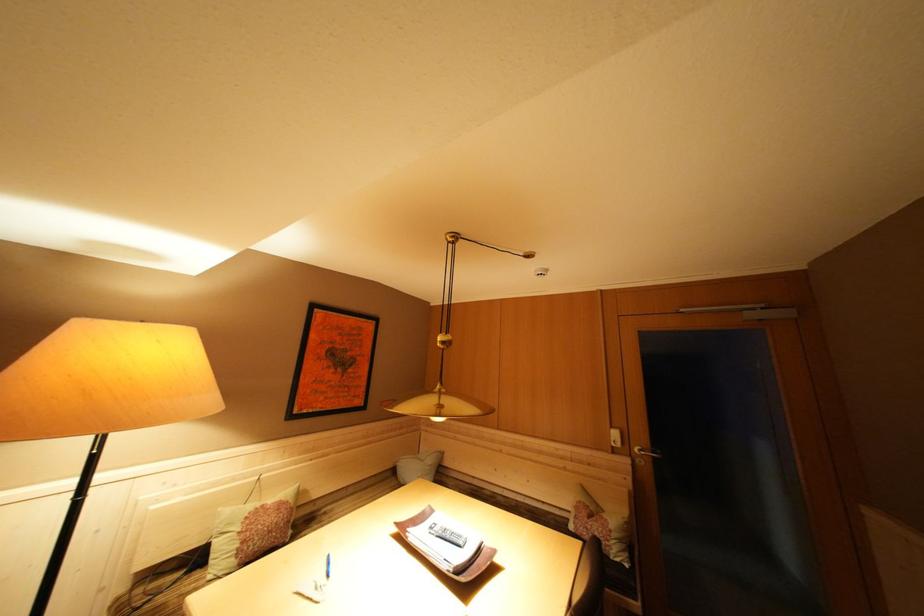
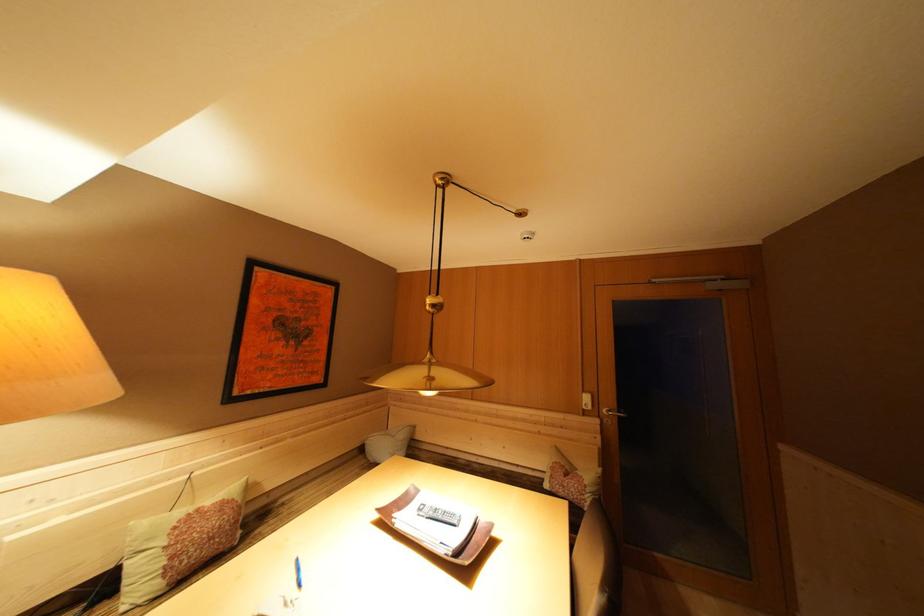
The point at (403, 529) is marked in the first image. Where is the corresponding point in the second image?

(384, 515)